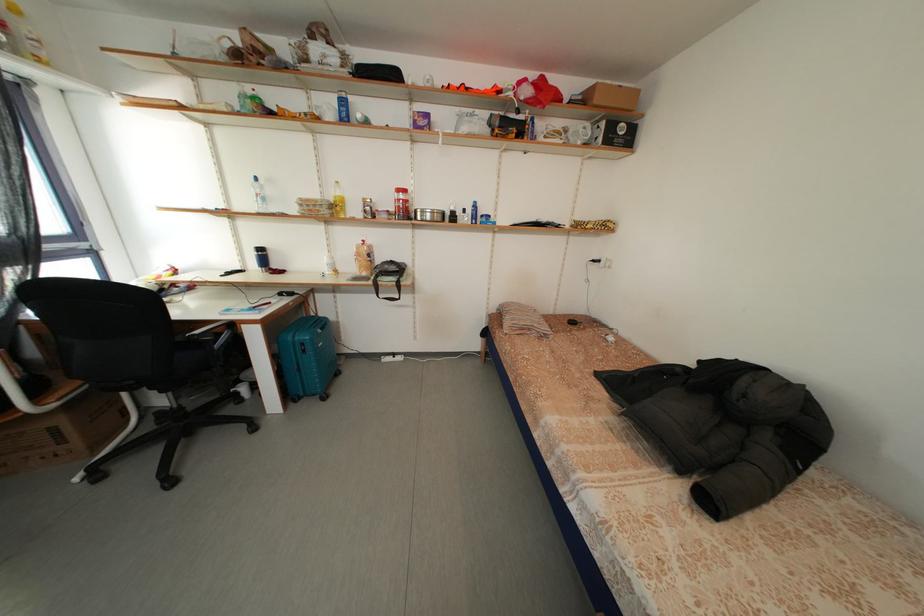
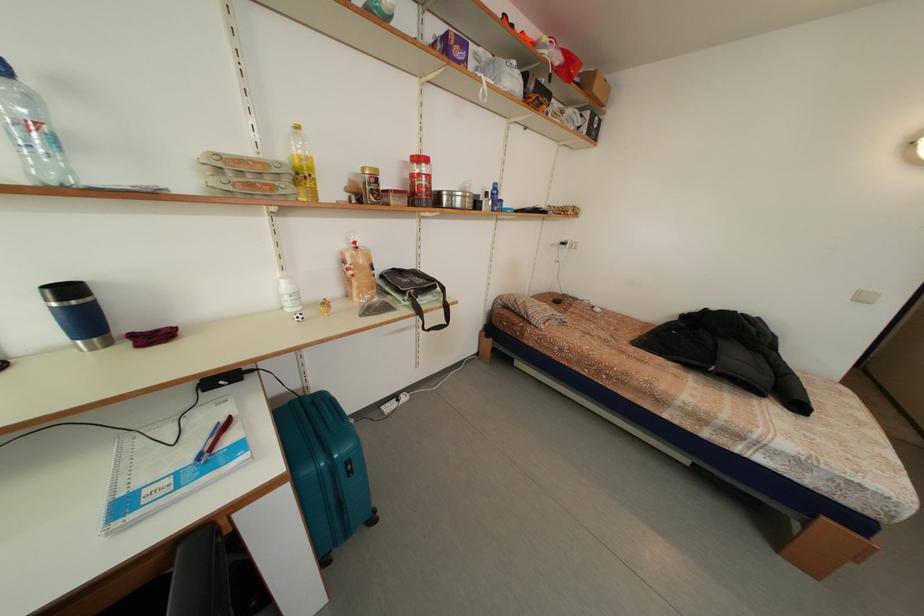
Locate, in the second image, the point that corresponds to point 604,105 in the first image.

(603, 95)